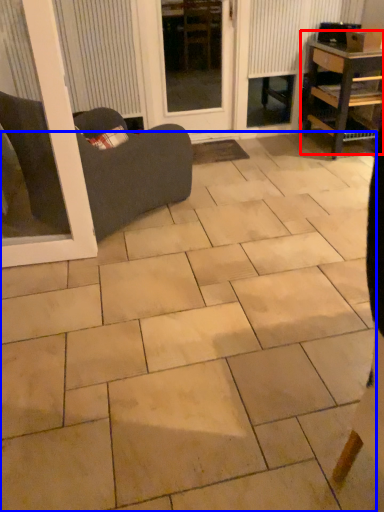
Question: Which point is further to the camera, table (highlighted by a red box) or ceramic tile (highlighted by a blue box)?

Choices:
 (A) table
 (B) ceramic tile

Answer: (A)